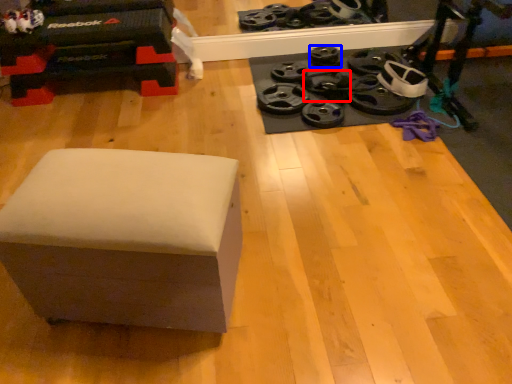
Question: Which object is closer to the camera taking this photo, wheel (highlighted by a red box) or wheel (highlighted by a blue box)?

Choices:
 (A) wheel
 (B) wheel

Answer: (A)